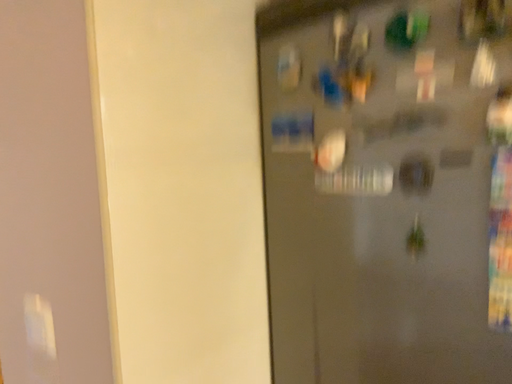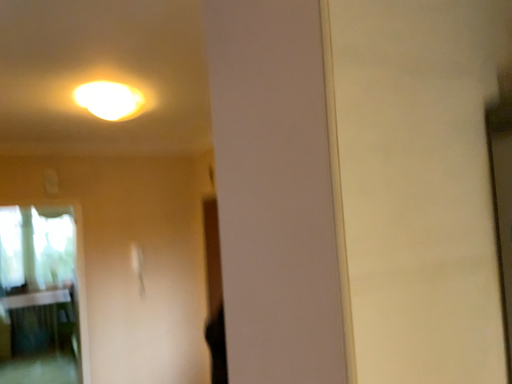
Question: Which way did the camera rotate in the video?

Choices:
 (A) rotated downward
 (B) rotated upward

Answer: (B)